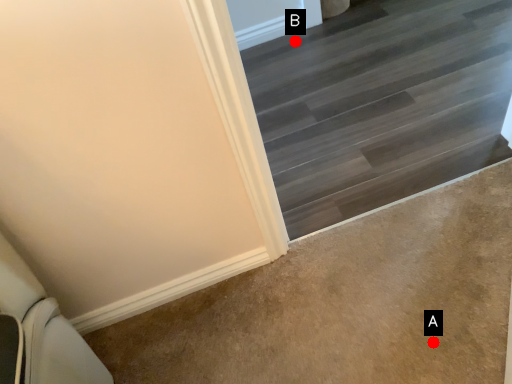
Question: Two points are circled on the image, labeled by A and B beside each circle. Which point is closer to the camera?

Choices:
 (A) A is closer
 (B) B is closer

Answer: (A)